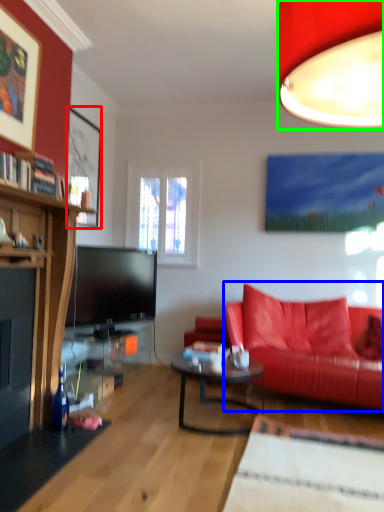
Question: Which object is positioned farthest from picture frame (highlighted by a red box)? Select from studio couch (highlighted by a blue box) and lamp (highlighted by a green box).

Choices:
 (A) studio couch
 (B) lamp

Answer: (B)